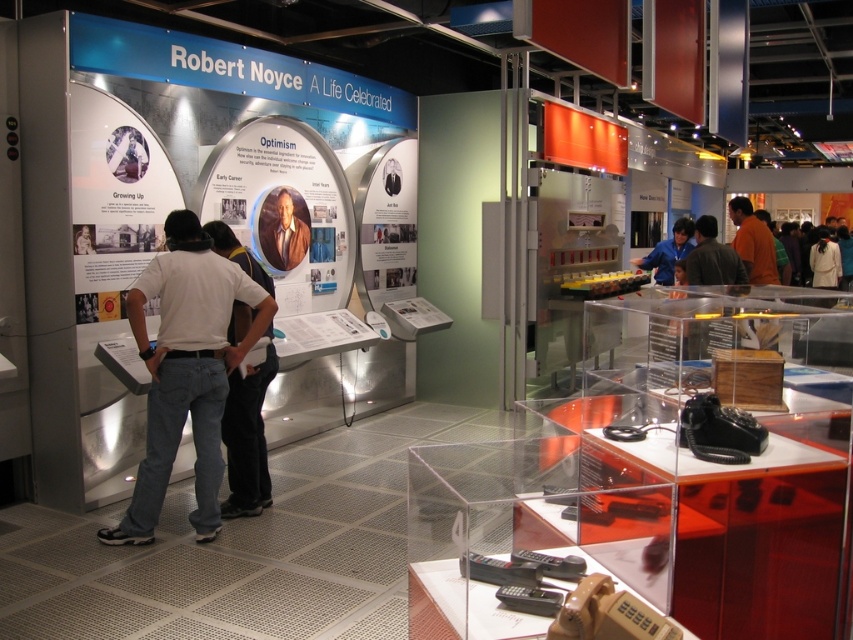
Question: Which object is farther from the camera taking this photo?

Choices:
 (A) matte silver display at center
 (B) orange shirt at right
 (C) white matte shirt at left

Answer: (B)

Question: In this image, where is white matte shirt at left located relative to white matte shirt at center?

Choices:
 (A) right
 (B) left

Answer: (B)

Question: Which point is farther from the camera taking this photo?

Choices:
 (A) (643, 259)
 (B) (270, 236)
 (C) (132, 540)

Answer: (A)

Question: Can you confirm if white matte shirt at left is positioned above orange shirt at right?

Choices:
 (A) no
 (B) yes

Answer: (A)

Question: Does matte brown suit at center have a smaller size compared to blue shirt at center?

Choices:
 (A) yes
 (B) no

Answer: (A)

Question: Which object is the farthest from the blue shirt at center?

Choices:
 (A) white matte shirt at center
 (B) matte silver poster at center
 (C) orange shirt at right
 (D) matte silver display at center

Answer: (A)